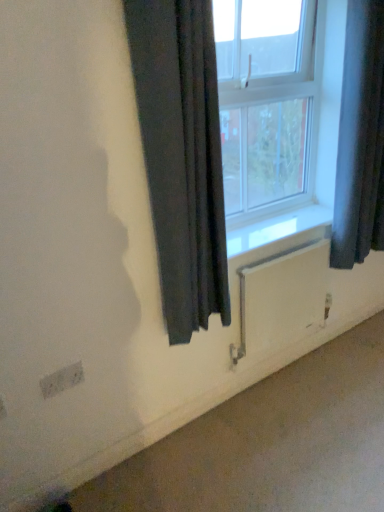
Measure the distance between smooth concrete at lower right and camera.

4.76 feet.

Identify the location of smooth concrete at lower right. (270, 443).

What do you see at coordinates (268, 102) in the screenshot? I see `white plastic window at center` at bounding box center [268, 102].

Locate an element on the screen. dark fabric curtain at right, acting as the 1th curtain starting from the right is located at coordinates [x=360, y=139].

What is the approximate height of white painted wood at lower center?

The height of white painted wood at lower center is 1.43 inches.

The width and height of the screenshot is (384, 512). What are the coordinates of `black fabric curtain at center, which appears as the 1th curtain when viewed from the left` in the screenshot? It's located at (182, 156).

Can you confirm if white matte radiator at lower center is bigger than black fabric curtain at center, the second curtain in the right-to-left sequence?

No.

Considering the positions of objects white matte radiator at lower center and black fabric curtain at center, which appears as the 1th curtain when viewed from the left, in the image provided, who is in front, white matte radiator at lower center or black fabric curtain at center, which appears as the 1th curtain when viewed from the left,?

black fabric curtain at center, which appears as the 1th curtain when viewed from the left, is closer to the camera.

Can you tell me how much white matte radiator at lower center and black fabric curtain at center, the second curtain in the right-to-left sequence, differ in facing direction?

They differ by 1.78 degrees in their facing directions.

Can we say white matte radiator at lower center lies outside black fabric curtain at center, which appears as the 1th curtain when viewed from the left?

Yes, white matte radiator at lower center is located beyond the bounds of black fabric curtain at center, which appears as the 1th curtain when viewed from the left.

Which of these two, black fabric curtain at center, the second curtain in the right-to-left sequence, or white plastic window at center, stands shorter?

With less height is white plastic window at center.

How different are the orientations of black fabric curtain at center, which appears as the 1th curtain when viewed from the left, and white plastic window at center in degrees?

There is a 0.00136-degree angle between the facing directions of black fabric curtain at center, which appears as the 1th curtain when viewed from the left, and white plastic window at center.

Based on the photo, is black fabric curtain at center, which appears as the 1th curtain when viewed from the left, positioned far away from white plastic window at center?

That's not correct — black fabric curtain at center, which appears as the 1th curtain when viewed from the left, is a little close to white plastic window at center.

Does black fabric curtain at center, the second curtain in the right-to-left sequence, turn towards white plastic window at center?

No, black fabric curtain at center, the second curtain in the right-to-left sequence, is not facing towards white plastic window at center.

Is smooth concrete at lower right directly adjacent to white textured electric outlet at lower left?

smooth concrete at lower right and white textured electric outlet at lower left are not in contact.

Which object is thinner, smooth concrete at lower right or white textured electric outlet at lower left?

white textured electric outlet at lower left.

Based on the photo, how far apart are smooth concrete at lower right and white textured electric outlet at lower left?

smooth concrete at lower right and white textured electric outlet at lower left are 31.57 inches apart from each other.

Does smooth concrete at lower right appear on the right side of white textured electric outlet at lower left?

Correct, you'll find smooth concrete at lower right to the right of white textured electric outlet at lower left.

How distant is white painted wood at lower center from smooth concrete at lower right?

They are 31.67 inches apart.

Which point is more distant from viewer, (248, 232) or (320, 424)?

The point (248, 232) is more distant.

Considering the sizes of objects white painted wood at lower center and smooth concrete at lower right in the image provided, who is bigger, white painted wood at lower center or smooth concrete at lower right?

smooth concrete at lower right is bigger.

From the image's perspective, is white painted wood at lower center over smooth concrete at lower right?

Yes.

From the image's perspective, who appears lower, dark fabric curtain at right, the second curtain from the left, or white plastic window at center?

dark fabric curtain at right, the second curtain from the left, appears lower in the image.

Which object is wider, dark fabric curtain at right, acting as the 1th curtain starting from the right, or white plastic window at center?

With larger width is dark fabric curtain at right, acting as the 1th curtain starting from the right.

Is dark fabric curtain at right, acting as the 1th curtain starting from the right, further to camera compared to white plastic window at center?

No, it is not.

How many degrees apart are the facing directions of dark fabric curtain at right, acting as the 1th curtain starting from the right, and white plastic window at center?

The angular difference between dark fabric curtain at right, acting as the 1th curtain starting from the right, and white plastic window at center is 0.00136 degrees.

Who is shorter, white textured electric outlet at lower left or white painted wood at lower center?

white painted wood at lower center is shorter.

Is white textured electric outlet at lower left wider or thinner than white painted wood at lower center?

Clearly, white textured electric outlet at lower left has less width compared to white painted wood at lower center.

Find the location of a particular element. window sill lying above the white textured electric outlet at lower left (from the image's perspective) is located at coordinates (276, 228).

Which of these two, white textured electric outlet at lower left or white painted wood at lower center, is smaller?

white textured electric outlet at lower left.

Which of these two, black fabric curtain at center, which appears as the 1th curtain when viewed from the left, or smooth concrete at lower right, is thinner?

Thinner between the two is black fabric curtain at center, which appears as the 1th curtain when viewed from the left.

Between black fabric curtain at center, the second curtain in the right-to-left sequence, and smooth concrete at lower right, which one appears on the right side from the viewer's perspective?

smooth concrete at lower right.

Could you measure the distance between black fabric curtain at center, the second curtain in the right-to-left sequence, and smooth concrete at lower right?

black fabric curtain at center, the second curtain in the right-to-left sequence, is 32.87 inches from smooth concrete at lower right.

From the image's perspective, which is above, black fabric curtain at center, which appears as the 1th curtain when viewed from the left, or smooth concrete at lower right?

black fabric curtain at center, which appears as the 1th curtain when viewed from the left, appears higher in the image.

You are a GUI agent. You are given a task and a screenshot of the screen. Output one action in this format:
    pyautogui.click(x=<x>, y=<y>)
    Task: Click on the radiator behind the black fabric curtain at center, which appears as the 1th curtain when viewed from the left
    The height and width of the screenshot is (512, 384).
    Given the screenshot: What is the action you would take?
    pyautogui.click(x=281, y=298)

Locate an element on the screen. This screenshot has height=512, width=384. window above the black fabric curtain at center, the second curtain in the right-to-left sequence (from a real-world perspective) is located at coordinates (268, 102).

In the scene shown: Estimate the real-world distances between objects in this image. Which object is further from white plastic window at center, smooth concrete at lower right or black fabric curtain at center, which appears as the 1th curtain when viewed from the left?

smooth concrete at lower right is positioned further to the anchor white plastic window at center.

Considering their positions, is white matte radiator at lower center positioned closer to white painted wood at lower center than white textured electric outlet at lower left?

white matte radiator at lower center is closer to white painted wood at lower center.

Which object lies nearer to the anchor point white matte radiator at lower center, black fabric curtain at center, the second curtain in the right-to-left sequence, or white textured electric outlet at lower left?

The object closer to white matte radiator at lower center is black fabric curtain at center, the second curtain in the right-to-left sequence.

Which object lies further to the anchor point white painted wood at lower center, dark fabric curtain at right, acting as the 1th curtain starting from the right, or smooth concrete at lower right?

smooth concrete at lower right lies further to white painted wood at lower center than the other object.

Consider the image. Which object lies further to the anchor point dark fabric curtain at right, acting as the 1th curtain starting from the right, black fabric curtain at center, the second curtain in the right-to-left sequence, or white plastic window at center?

Among the two, black fabric curtain at center, the second curtain in the right-to-left sequence, is located further to dark fabric curtain at right, acting as the 1th curtain starting from the right.

Which object lies nearer to the anchor point dark fabric curtain at right, acting as the 1th curtain starting from the right, white plastic window at center or white textured electric outlet at lower left?

white plastic window at center.

In the scene shown: Which object lies further to the anchor point white painted wood at lower center, black fabric curtain at center, the second curtain in the right-to-left sequence, or smooth concrete at lower right?

Based on the image, smooth concrete at lower right appears to be further to white painted wood at lower center.

Estimate the real-world distances between objects in this image. Which object is closer to white textured electric outlet at lower left, white painted wood at lower center or smooth concrete at lower right?

smooth concrete at lower right is closer to white textured electric outlet at lower left.

What are the coordinates of `curtain located between white textured electric outlet at lower left and smooth concrete at lower right in the left-right direction` in the screenshot? It's located at (182, 156).

Locate an element on the screen. The width and height of the screenshot is (384, 512). window sill situated between white textured electric outlet at lower left and smooth concrete at lower right from left to right is located at coordinates (276, 228).

You are a GUI agent. You are given a task and a screenshot of the screen. Output one action in this format:
    pyautogui.click(x=<x>, y=<y>)
    Task: Click on the radiator between black fabric curtain at center, which appears as the 1th curtain when viewed from the left, and dark fabric curtain at right, the second curtain from the left, in the horizontal direction
    
    Given the screenshot: What is the action you would take?
    pyautogui.click(x=281, y=298)

Where is `window sill that lies between white plastic window at center and white textured electric outlet at lower left from top to bottom`? This screenshot has height=512, width=384. window sill that lies between white plastic window at center and white textured electric outlet at lower left from top to bottom is located at coordinates pyautogui.click(x=276, y=228).